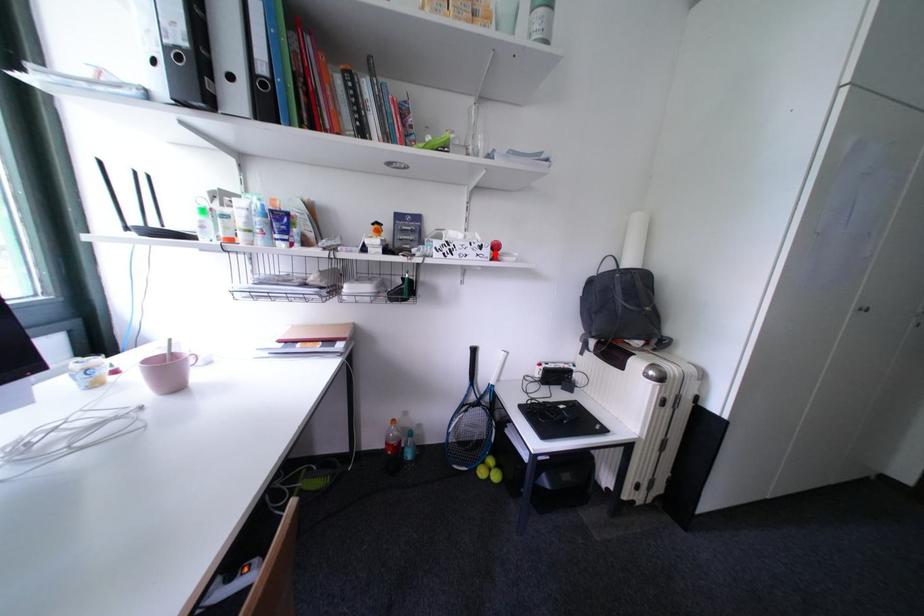
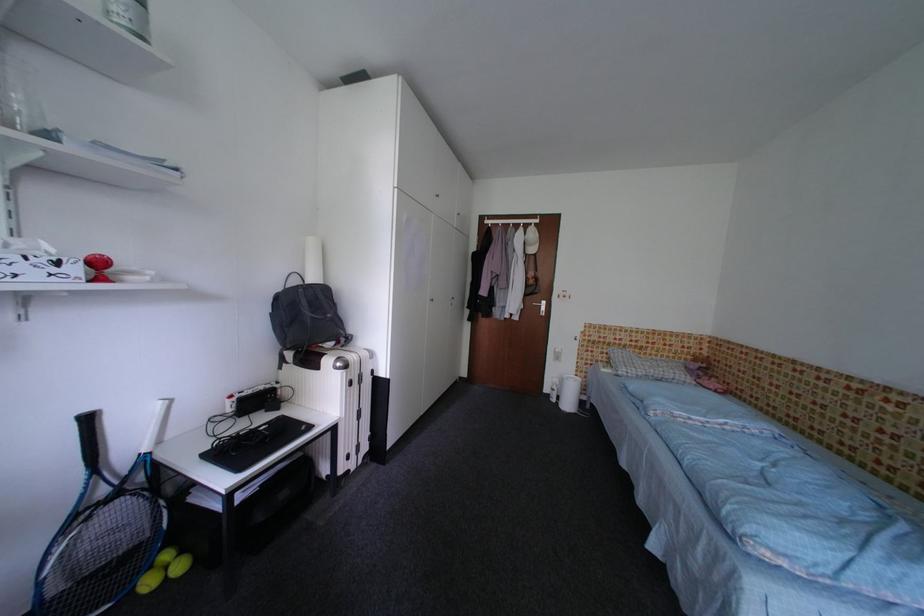
Find the pixel in the second image that matches the highlighted location in the first image.

(83, 272)